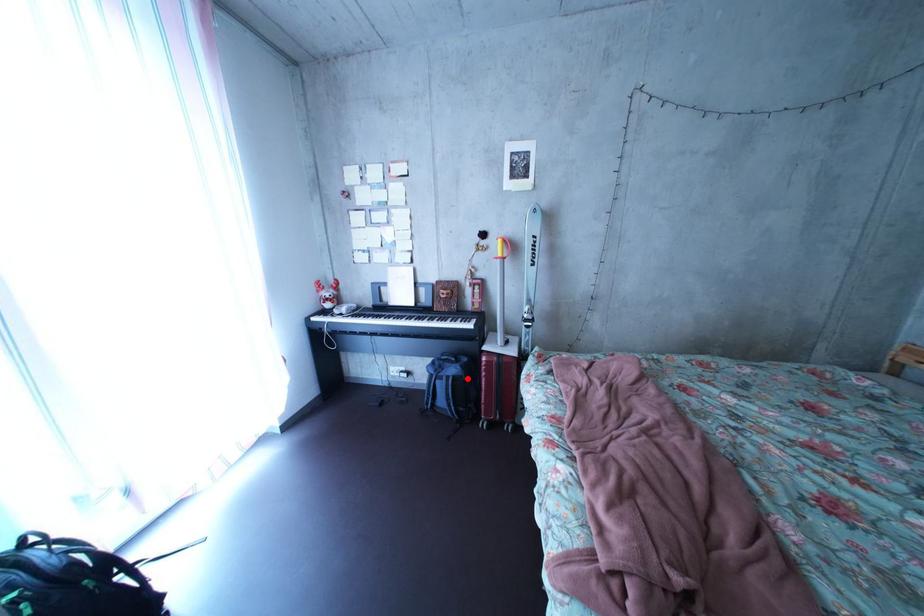
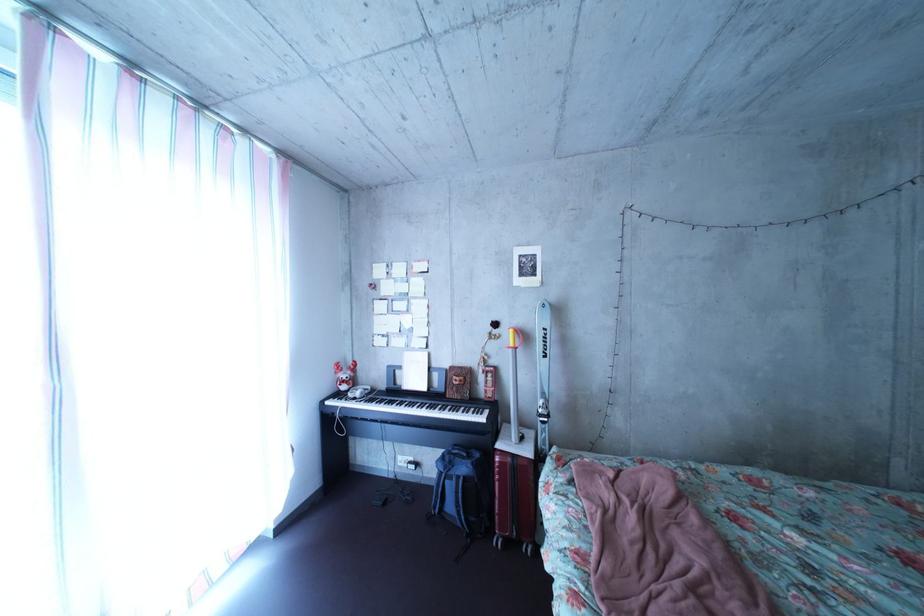
The point at the highlighted location is marked in the first image. Where is the corresponding point in the second image?

(479, 477)